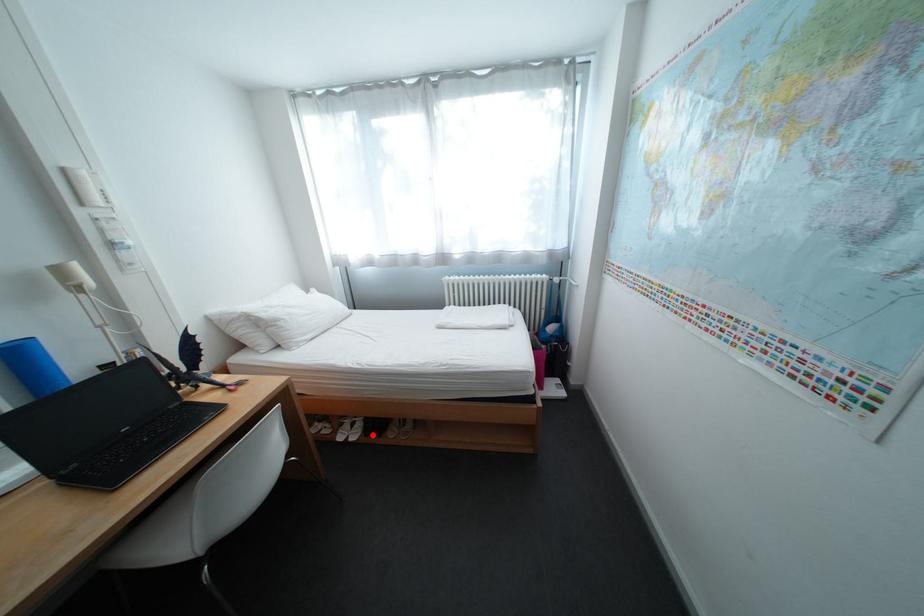
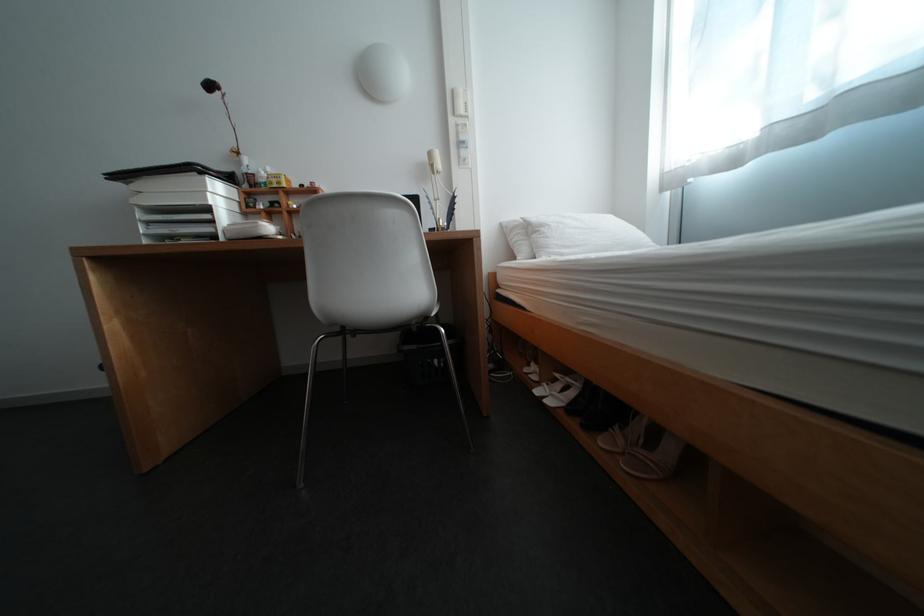
Question: I am providing you with two images of the same scene from different viewpoints. A red point is shown in image1. For the corresponding object point in image2, is it positioned nearer or farther from the camera?

Choices:
 (A) Nearer
 (B) Farther

Answer: (A)